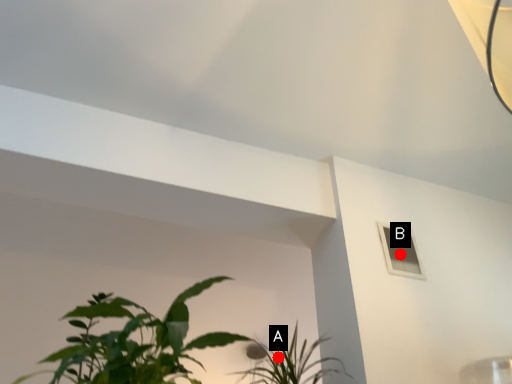
Question: Two points are circled on the image, labeled by A and B beside each circle. Which point is closer to the camera taking this photo?

Choices:
 (A) A is closer
 (B) B is closer

Answer: (B)